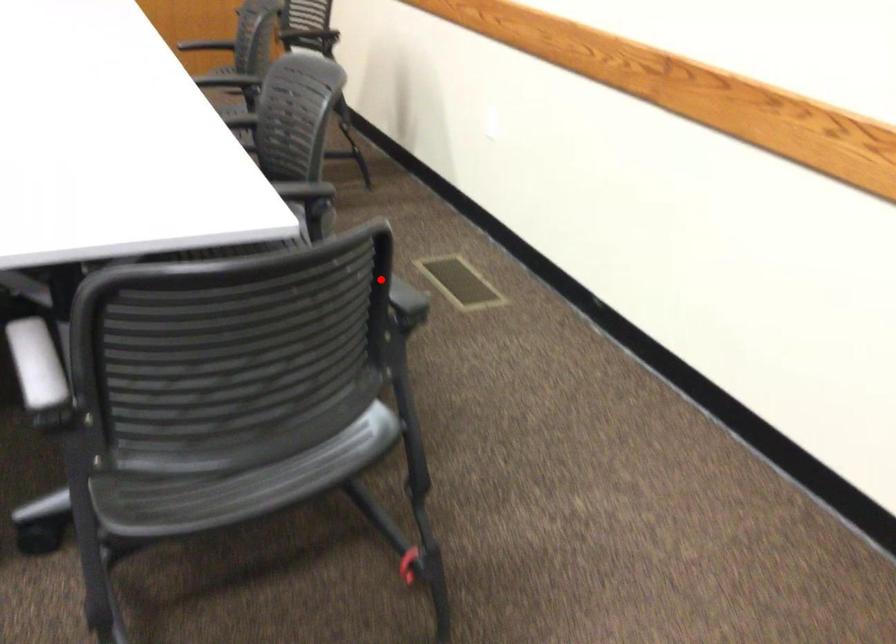
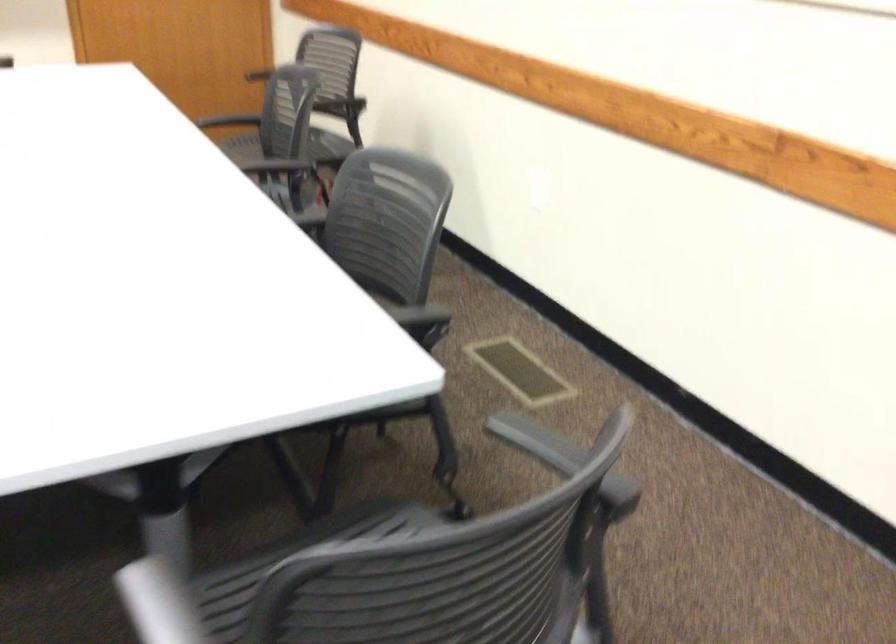
Find the pixel in the second image that matches the highlighted location in the first image.

(563, 458)